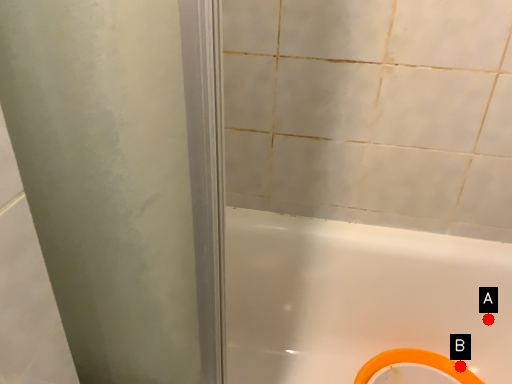
Question: Two points are circled on the image, labeled by A and B beside each circle. Which point is closer to the camera?

Choices:
 (A) A is closer
 (B) B is closer

Answer: (B)